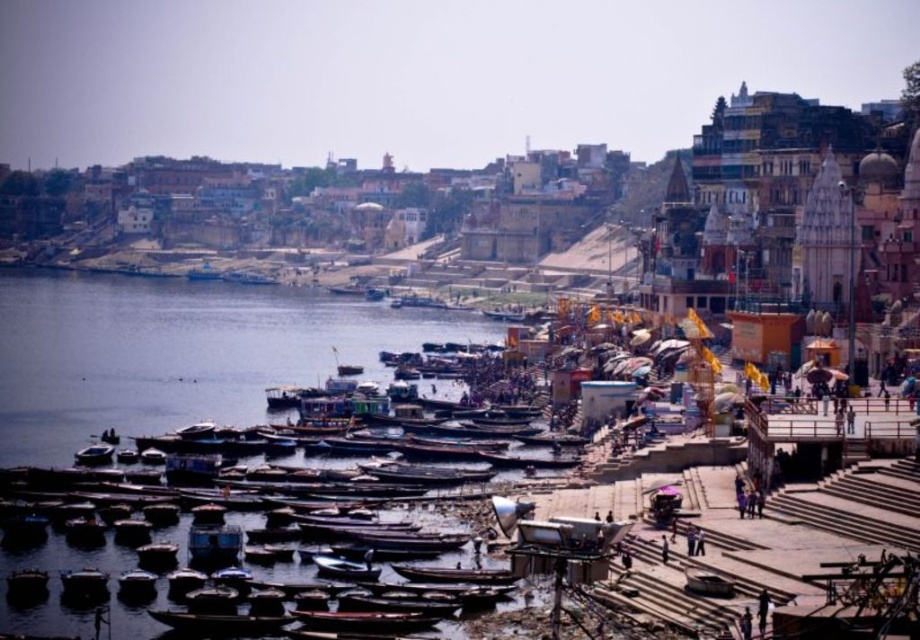
Question: Which point is closer to the camera?

Choices:
 (A) wooden boats at center
 (B) wooden boat at lower right
 (C) wooden boat at lower left

Answer: (B)

Question: Is wooden boats at center closer to camera compared to wooden boat at center?

Choices:
 (A) no
 (B) yes

Answer: (B)

Question: Is wooden boats at center to the left of wooden boat at lower left from the viewer's perspective?

Choices:
 (A) no
 (B) yes

Answer: (B)

Question: Estimate the real-world distances between objects in this image. Which object is farther from the white plastic boat at center?

Choices:
 (A) brown wooden boats at lower left
 (B) metallic blue boat at center
 (C) wooden boat at lower right

Answer: (C)

Question: Estimate the real-world distances between objects in this image. Which object is closer to the wooden boat at lower left?

Choices:
 (A) brown wooden boats at lower left
 (B) wooden boat at center

Answer: (A)

Question: Can you confirm if brown wooden boats at lower left is positioned to the left of white plastic boat at center?

Choices:
 (A) no
 (B) yes

Answer: (A)